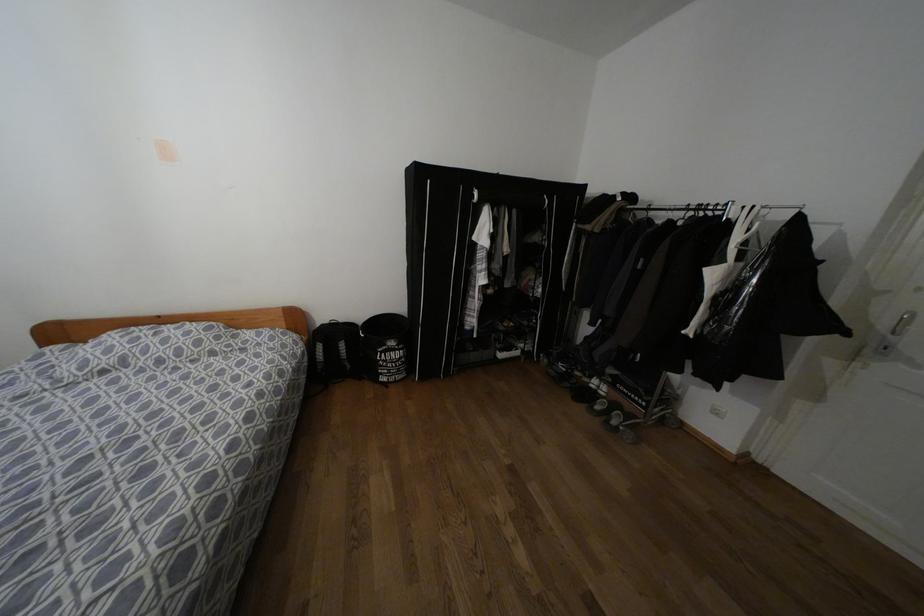
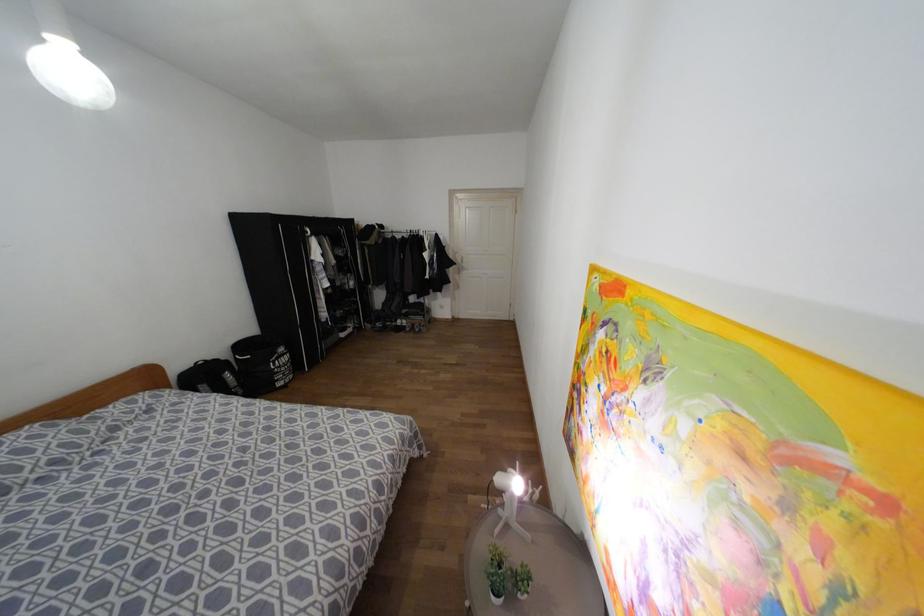
Find the pixel in the second image that matches the point at 391,342 in the first image.

(281, 349)